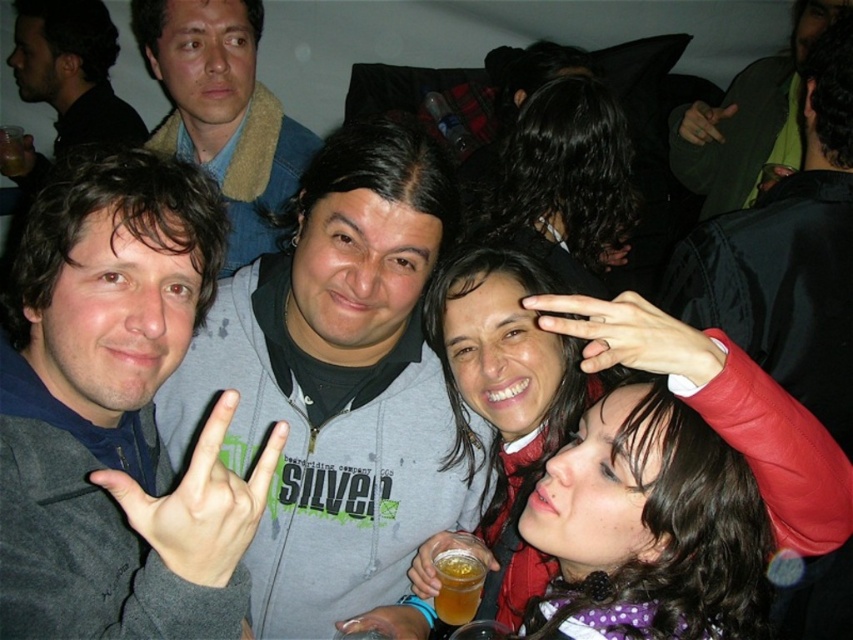
You are at a party and see two hands in the image. The matte black hand at upper center and the dark skin hand at lower center. Which hand is positioned higher?

The matte black hand at upper center is positioned higher than the dark skin hand at lower center.

You are at a party and want to grab a drink. You see a translucent plastic cup at lower center and a green matte ring at upper center. Which object is nearer to you?

The translucent plastic cup at lower center is closer to the viewer than the green matte ring at upper center.